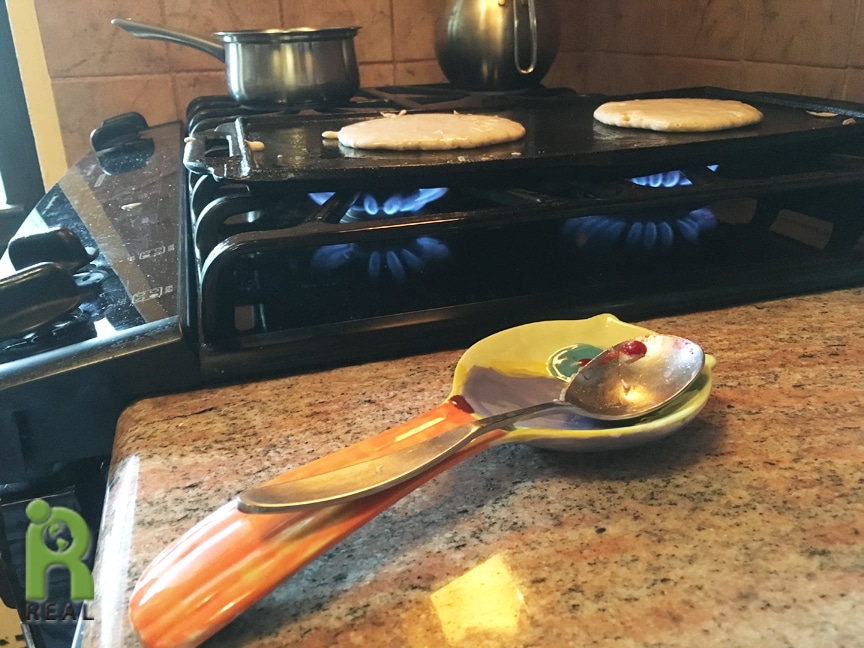
Where is `griddle`? griddle is located at coordinates (316, 137).